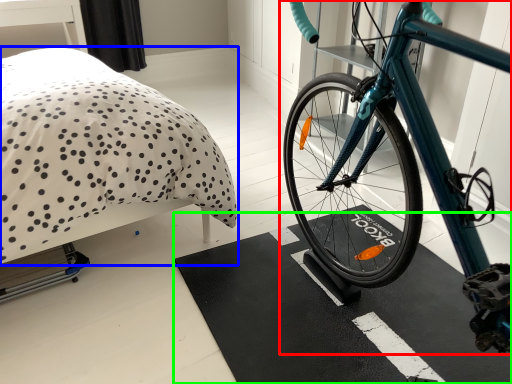
Question: Which is nearer to the bicycle (highlighted by a red box)? bed (highlighted by a blue box) or bath mat (highlighted by a green box).

Choices:
 (A) bed
 (B) bath mat

Answer: (B)